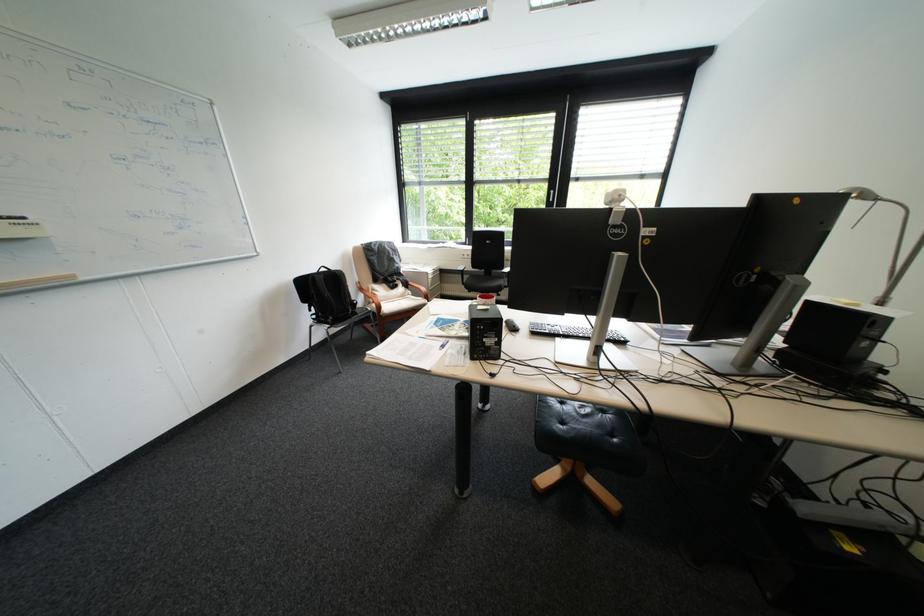
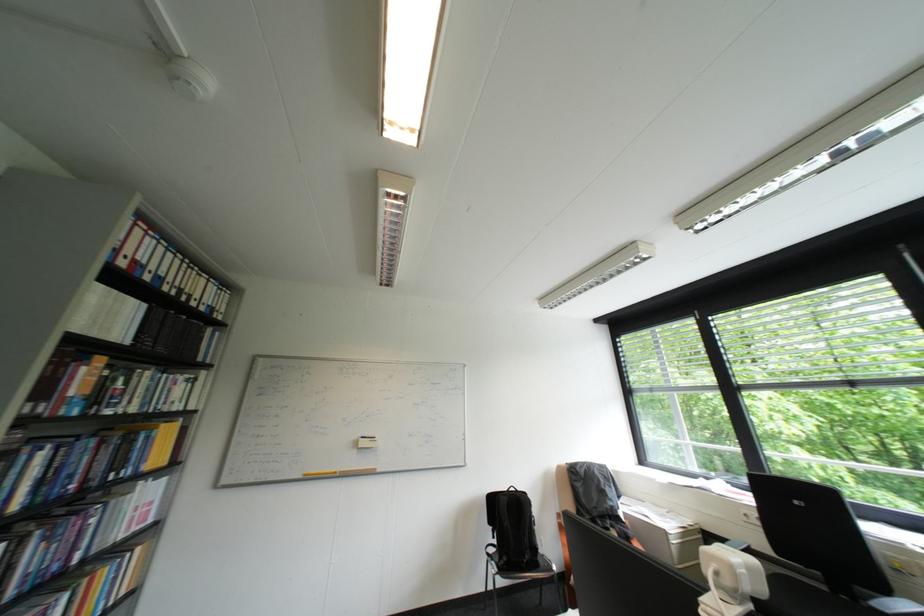
The first image is from the beginning of the video and the second image is from the end. How did the camera likely rotate when shooting the video?

The rotation direction of the camera is left-up.